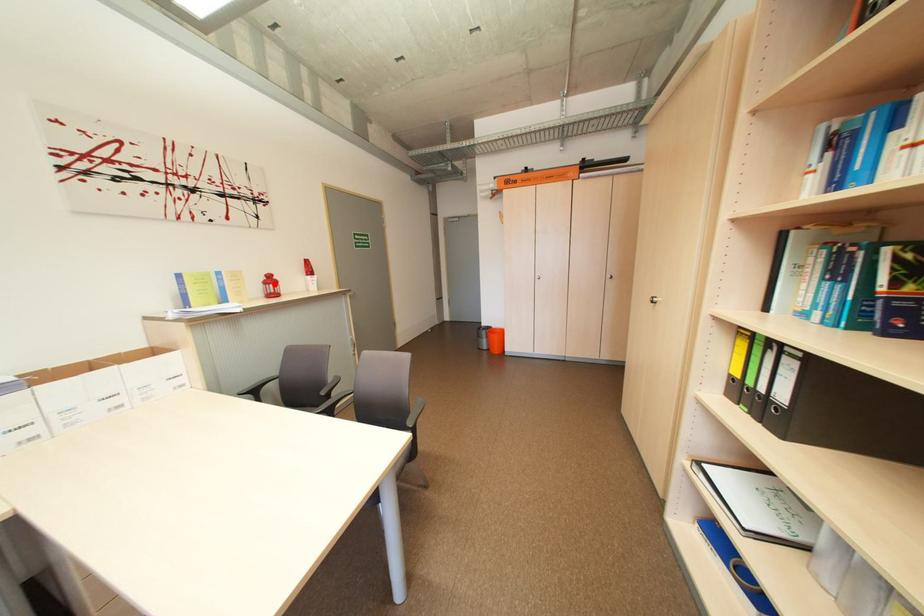
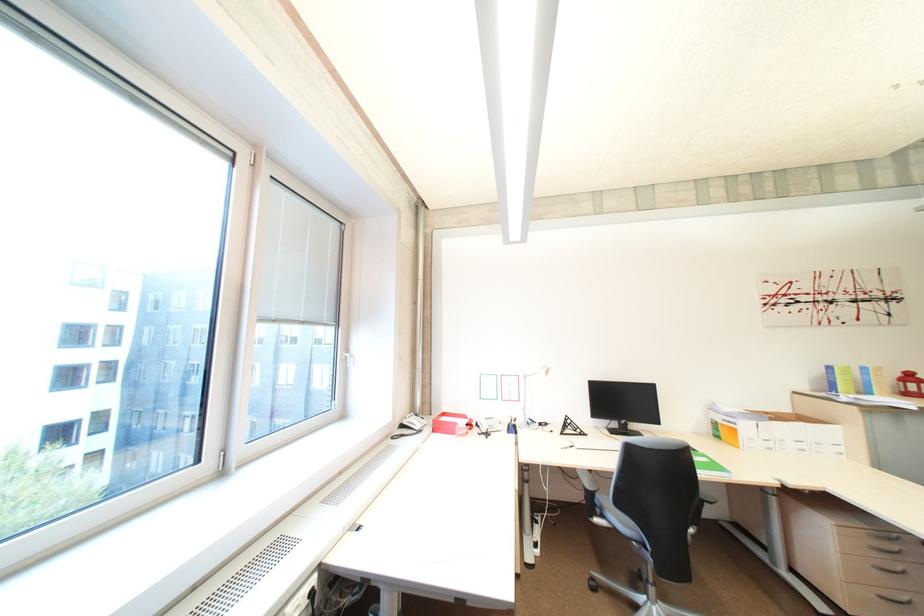
Find the pixel in the second image that matches the highlighted location in the first image.

(913, 382)